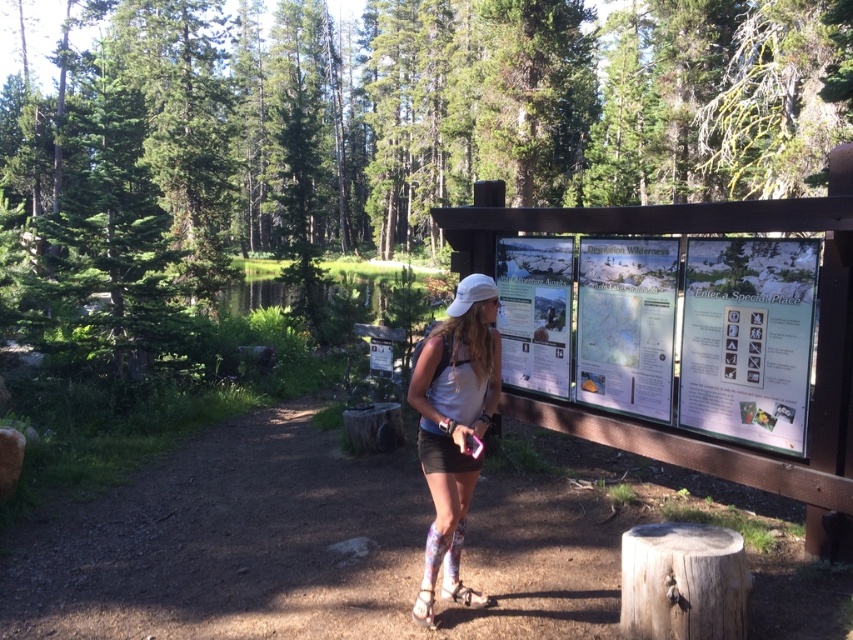
Question: Can you confirm if white matte shorts at center is smaller than wooden stump at lower right?

Choices:
 (A) yes
 (B) no

Answer: (B)

Question: Which point is farther from the camera taking this photo?

Choices:
 (A) pyautogui.click(x=656, y=627)
 (B) pyautogui.click(x=469, y=454)

Answer: (B)

Question: Is white matte shorts at center wider than wooden stump at lower right?

Choices:
 (A) yes
 (B) no

Answer: (B)

Question: Can you confirm if white matte shorts at center is positioned to the right of wooden stump at lower right?

Choices:
 (A) no
 (B) yes

Answer: (A)

Question: Which object is farther from the camera taking this photo?

Choices:
 (A) wooden stump at lower right
 (B) white matte shorts at center

Answer: (B)